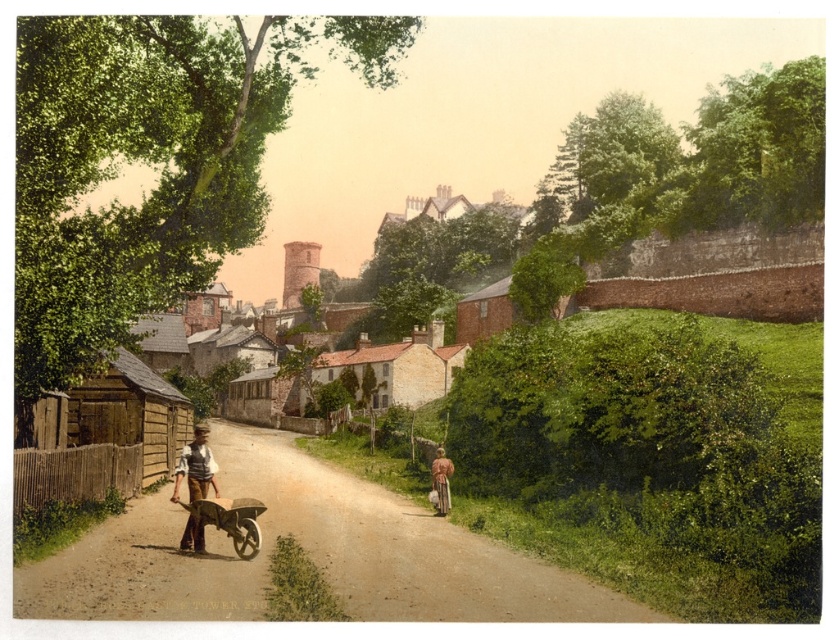
Can you confirm if brown dirt track at center is shorter than light brown fabric dress at lower right?

No, brown dirt track at center is not shorter than light brown fabric dress at lower right.

Does brown dirt track at center appear under light brown fabric dress at lower right?

Yes.

Describe the element at coordinates (308, 554) in the screenshot. This screenshot has height=640, width=839. I see `brown dirt track at center` at that location.

Identify the location of brown dirt track at center. (308, 554).

Is brown leather pants at left taller than light brown fabric dress at lower right?

Yes, brown leather pants at left is taller than light brown fabric dress at lower right.

Can you confirm if brown leather pants at left is smaller than light brown fabric dress at lower right?

No, brown leather pants at left is not smaller than light brown fabric dress at lower right.

Which is in front, point (202, 477) or point (441, 474)?

Point (202, 477) is in front.

At what (x,y) coordinates should I click in order to perform the action: click on brown leather pants at left. Please return your answer as a coordinate pair (x, y). Looking at the image, I should click on (196, 467).

Is point (195, 522) positioned after point (181, 544)?

Yes, point (195, 522) is farther from viewer.

Who is more forward, (223, 513) or (202, 532)?

Point (223, 513) is in front.

You are a GUI agent. You are given a task and a screenshot of the screen. Output one action in this format:
    pyautogui.click(x=<x>, y=<y>)
    Task: Click on the wooden wheelbarrow at lower left
    The image size is (839, 640).
    Given the screenshot: What is the action you would take?
    pyautogui.click(x=227, y=522)

Identify the location of wooden wheelbarrow at lower left. This screenshot has width=839, height=640. [x=227, y=522].